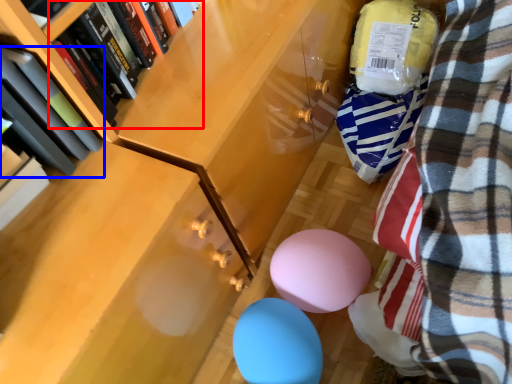
Question: Which object is closer to the camera taking this photo, book (highlighted by a red box) or book (highlighted by a blue box)?

Choices:
 (A) book
 (B) book

Answer: (B)